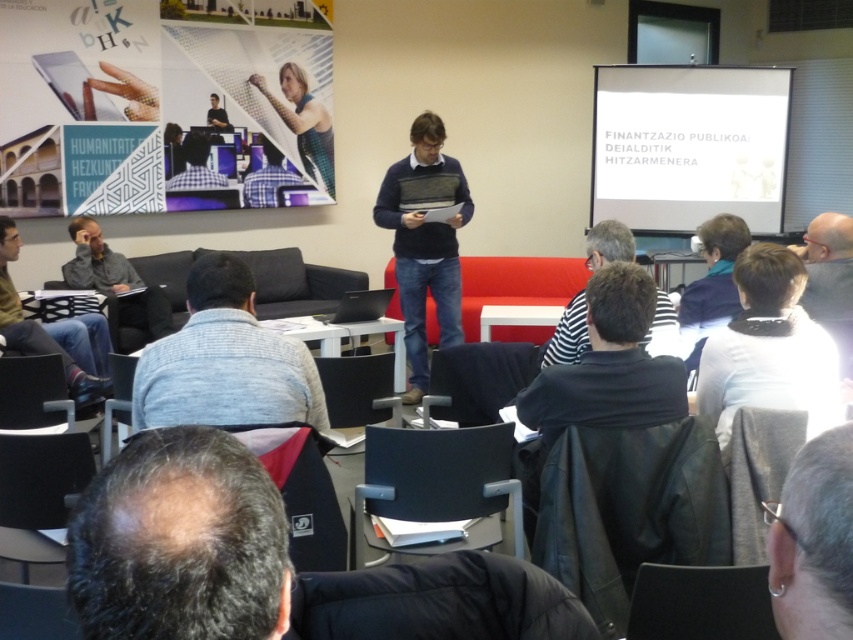
Between white fleece at lower right and gray hair at upper right, which one is positioned higher?

Positioned higher is gray hair at upper right.

Between white fleece at lower right and gray hair at upper right, which one has more height?

With more height is gray hair at upper right.

Locate an element on the screen. The image size is (853, 640). white fleece at lower right is located at coordinates (767, 346).

Can you confirm if gray sweater at lower left is positioned to the left of matte black laptop at center?

Indeed, gray sweater at lower left is positioned on the left side of matte black laptop at center.

Is gray sweater at lower left taller than matte black laptop at center?

Indeed, gray sweater at lower left has a greater height compared to matte black laptop at center.

This screenshot has height=640, width=853. What are the coordinates of `gray sweater at lower left` in the screenshot? It's located at (51, 330).

Identify the location of gray sweater at lower left. The height and width of the screenshot is (640, 853). (51, 330).

Is gray sweater at center above gray sweater at left?

Actually, gray sweater at center is below gray sweater at left.

From the picture: Which is above, gray sweater at center or gray sweater at left?

gray sweater at left is higher up.

Describe the element at coordinates (225, 362) in the screenshot. I see `gray sweater at center` at that location.

Find the location of `gray sweater at center`. gray sweater at center is located at coordinates (225, 362).